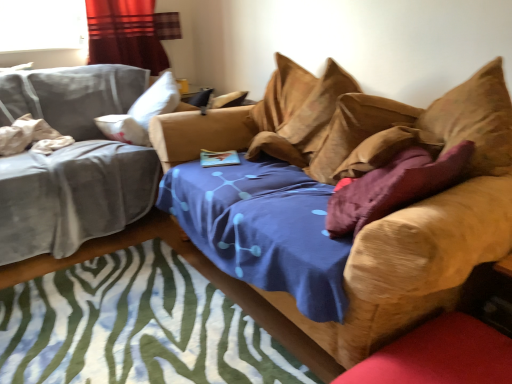
Question: Does velvet curtain at upper left appear on the left side of white cotton pillow at left, placed as the fourth pillow when sorted from right to left?

Choices:
 (A) yes
 (B) no

Answer: (B)

Question: From a real-world perspective, does velvet curtain at upper left stand above white cotton pillow at left, which is the 1th pillow from left to right?

Choices:
 (A) yes
 (B) no

Answer: (A)

Question: From a real-world perspective, is velvet curtain at upper left below white cotton pillow at left, placed as the fourth pillow when sorted from right to left?

Choices:
 (A) yes
 (B) no

Answer: (B)

Question: Would you consider velvet curtain at upper left to be distant from white cotton pillow at left, which is the 1th pillow from left to right?

Choices:
 (A) no
 (B) yes

Answer: (A)

Question: Does velvet curtain at upper left come in front of white cotton pillow at left, which is the 1th pillow from left to right?

Choices:
 (A) yes
 (B) no

Answer: (B)

Question: Is velvet curtain at upper left aimed at white cotton pillow at left, placed as the fourth pillow when sorted from right to left?

Choices:
 (A) yes
 (B) no

Answer: (B)

Question: Is white cotton pillow at left, placed as the fourth pillow when sorted from right to left, inside velvet purple pillow at center, marked as the third pillow in a left-to-right arrangement?

Choices:
 (A) yes
 (B) no

Answer: (B)

Question: Is velvet purple pillow at center, marked as the third pillow in a left-to-right arrangement, not inside white cotton pillow at left, which is the 1th pillow from left to right?

Choices:
 (A) yes
 (B) no

Answer: (A)

Question: Considering the relative sizes of velvet purple pillow at center, marked as the third pillow in a left-to-right arrangement, and white cotton pillow at left, which is the 1th pillow from left to right, in the image provided, is velvet purple pillow at center, marked as the third pillow in a left-to-right arrangement, smaller than white cotton pillow at left, which is the 1th pillow from left to right,?

Choices:
 (A) no
 (B) yes

Answer: (A)

Question: Can you confirm if velvet purple pillow at center, marked as the third pillow in a left-to-right arrangement, is taller than white cotton pillow at left, placed as the fourth pillow when sorted from right to left?

Choices:
 (A) no
 (B) yes

Answer: (B)

Question: Is velvet purple pillow at center, which is the second pillow in right-to-left order, wider than white cotton pillow at left, placed as the fourth pillow when sorted from right to left?

Choices:
 (A) no
 (B) yes

Answer: (A)

Question: Are velvet purple pillow at center, marked as the third pillow in a left-to-right arrangement, and white cotton pillow at left, which is the 1th pillow from left to right, making contact?

Choices:
 (A) yes
 (B) no

Answer: (B)

Question: Does white cotton pillow at left, placed as the fourth pillow when sorted from right to left, have a greater width compared to suede-like tan pillow at upper center, marked as the third pillow in a right-to-left arrangement?

Choices:
 (A) yes
 (B) no

Answer: (A)